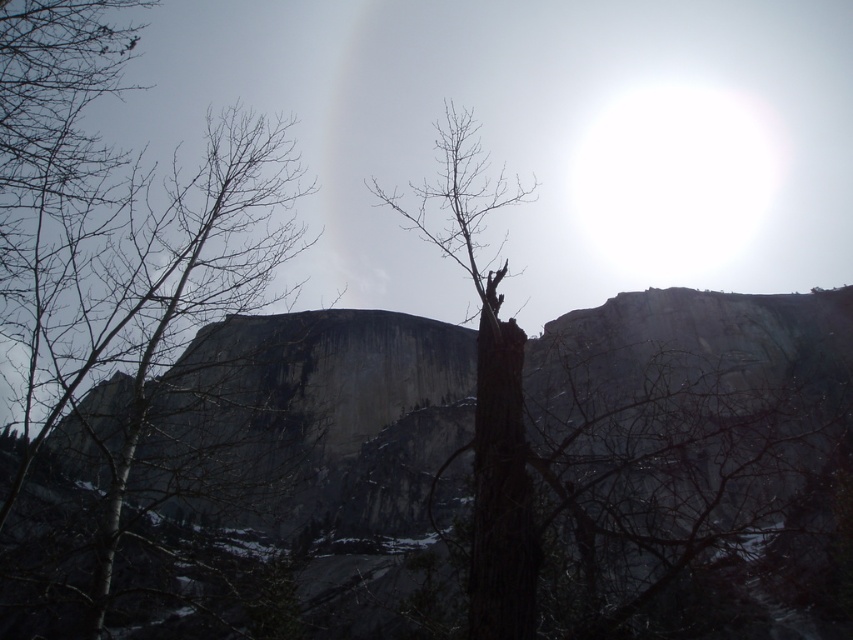
From the picture: Who is more forward, (637, 356) or (21, 93)?

Point (21, 93)

Based on the photo, is granite cliff at center above bare wood tree at left?

Incorrect, granite cliff at center is not positioned above bare wood tree at left.

Who is more distant from viewer, (693, 348) or (111, 332)?

The point (693, 348) is more distant.

Find the location of `granite cliff at center`. granite cliff at center is located at coordinates (309, 420).

Who is positioned more to the right, bare wood tree at left or brown rough bark tree at center?

brown rough bark tree at center

Is bare wood tree at left smaller than brown rough bark tree at center?

Indeed, bare wood tree at left has a smaller size compared to brown rough bark tree at center.

Is point (183, 268) farther from camera compared to point (431, 193)?

That is False.

I want to click on bare wood tree at left, so click(117, 234).

From the picture: Does granite cliff at center have a larger size compared to brown rough bark tree at center?

Yes, granite cliff at center is bigger than brown rough bark tree at center.

Locate an element on the screen. This screenshot has width=853, height=640. granite cliff at center is located at coordinates (309, 420).